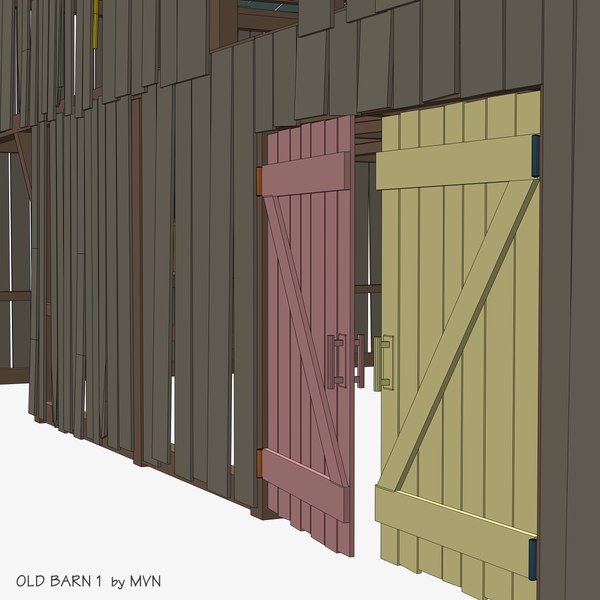
Identify the location of bottom of door. (288, 504).